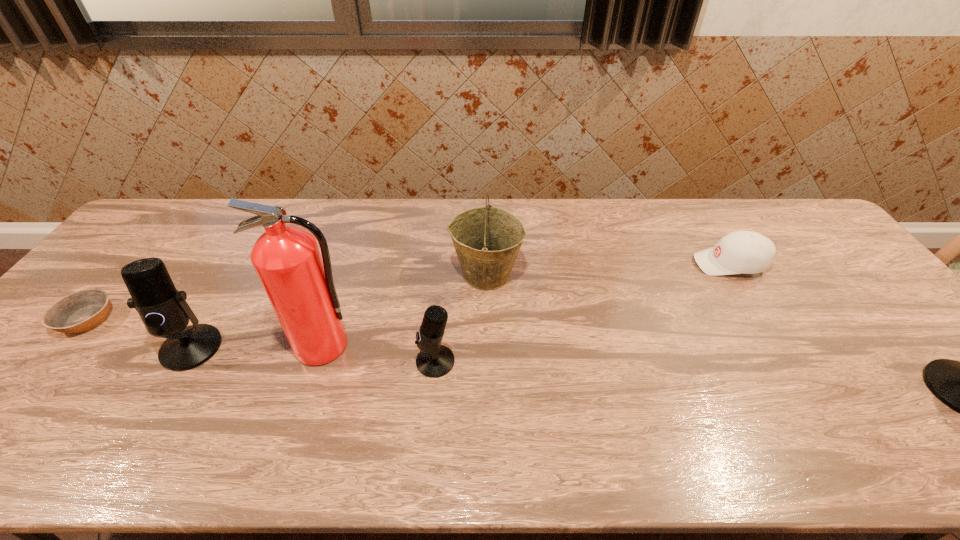
The width and height of the screenshot is (960, 540). In order to click on vacant spot for a new microphone to ensure equal spacing in this screenshot , I will do `click(693, 376)`.